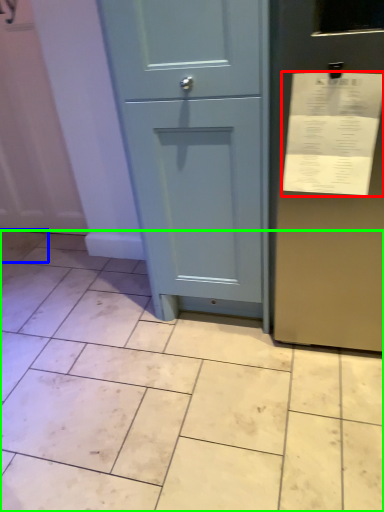
Question: Which object is positioned farthest from receipt (highlighted by a red box)? Select from ceramic tile (highlighted by a blue box) and ceramic tile (highlighted by a green box).

Choices:
 (A) ceramic tile
 (B) ceramic tile

Answer: (A)